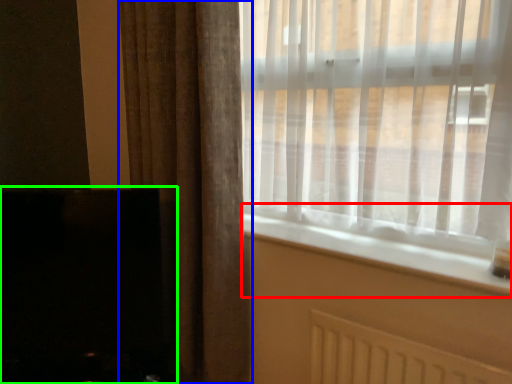
Question: Considering the real-world distances, which object is farthest from window sill (highlighted by a red box)? curtain (highlighted by a blue box) or fireplace (highlighted by a green box)?

Choices:
 (A) curtain
 (B) fireplace

Answer: (B)